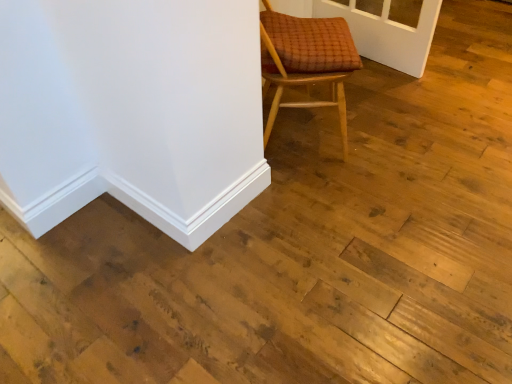
Where is `free region under brown woven cushioned chair at upper right (from a real-world perspective)`? This screenshot has width=512, height=384. free region under brown woven cushioned chair at upper right (from a real-world perspective) is located at coordinates (305, 135).